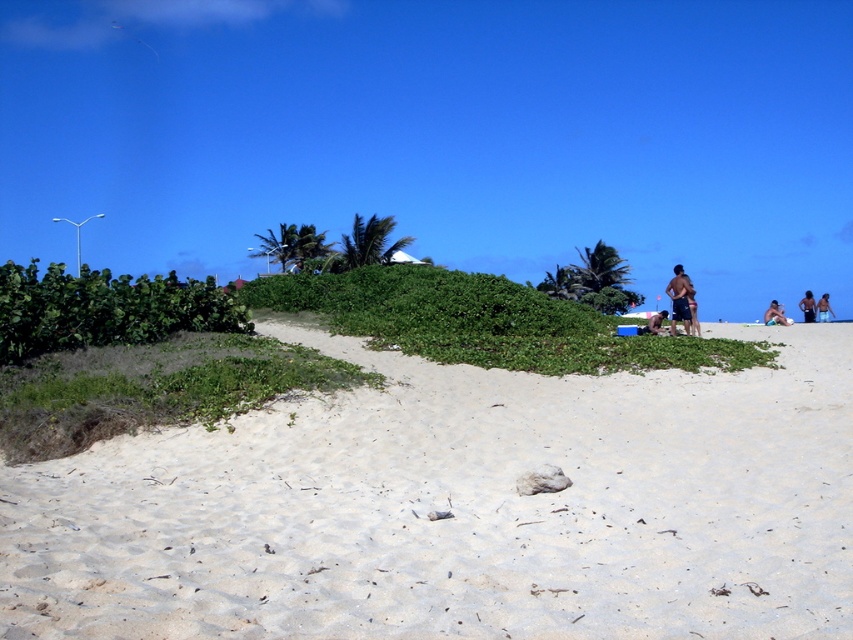
Question: Does white sandy beach at center have a greater width compared to green leafy bush at left?

Choices:
 (A) yes
 (B) no

Answer: (B)

Question: Considering the relative positions of green leafy bush at center and brown fabric person at lower right in the image provided, where is green leafy bush at center located with respect to brown fabric person at lower right?

Choices:
 (A) below
 (B) above

Answer: (B)

Question: Considering the real-world distances, which object is farthest from the tan skin person at right?

Choices:
 (A) tan skin person at upper right
 (B) brown fabric person at lower right
 (C) white sandy beach at center

Answer: (C)

Question: Which object appears closest to the camera in this image?

Choices:
 (A) brown skin at upper right
 (B) white sandy beach at center
 (C) brown fabric person at lower right

Answer: (B)

Question: Which object is the closest to the green leafy bush at center?

Choices:
 (A) brown textured shorts at right
 (B) brown fabric person at lower right

Answer: (B)

Question: Is green leafy bush at left to the left of tan skin person at upper right from the viewer's perspective?

Choices:
 (A) no
 (B) yes

Answer: (B)